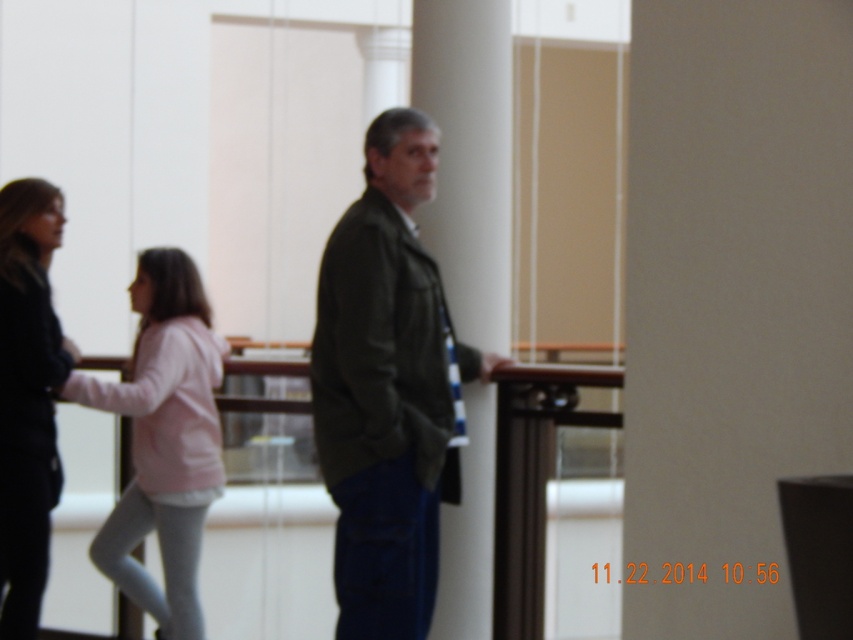
Question: Which object is positioned closest to the white smooth pillar at center?

Choices:
 (A) dark green jacket at center
 (B) black leather jacket at left

Answer: (A)

Question: From the image, what is the correct spatial relationship of dark green jacket at center in relation to black leather jacket at left?

Choices:
 (A) right
 (B) left

Answer: (A)

Question: Is dark green jacket at center wider than pink fleece jacket at center?

Choices:
 (A) no
 (B) yes

Answer: (A)

Question: Based on their relative distances, which object is nearer to the white smooth pillar at center?

Choices:
 (A) pink fleece jacket at center
 (B) black leather jacket at left
 (C) dark green jacket at center

Answer: (C)

Question: Among these points, which one is nearest to the camera?

Choices:
 (A) (341, 605)
 (B) (44, 468)

Answer: (A)

Question: Is dark green jacket at center below white smooth pillar at center?

Choices:
 (A) no
 (B) yes

Answer: (B)